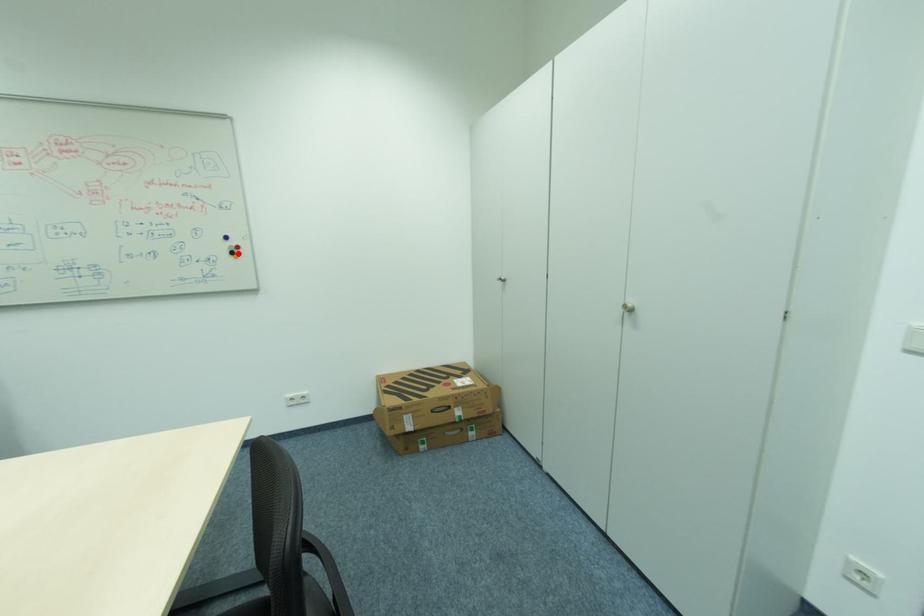
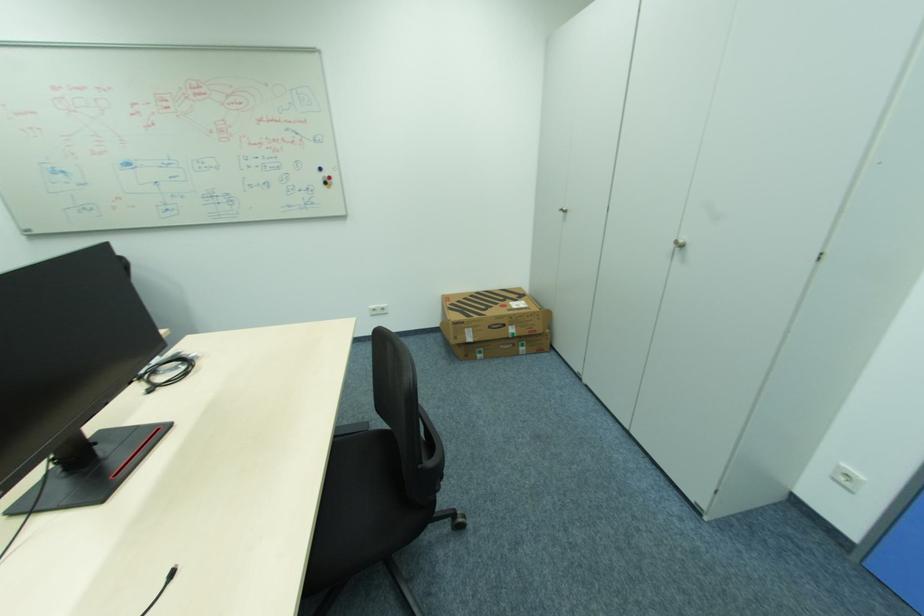
In the second image, find the point that corresponds to the highlighted location in the first image.

(331, 184)